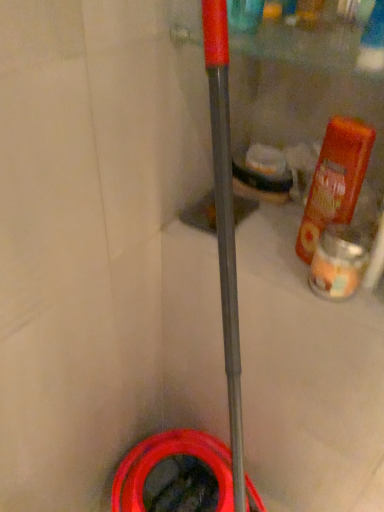
Question: From a real-world perspective, is orange matte bottle at right located higher than rubber/matte garden hose at lower center?

Choices:
 (A) no
 (B) yes

Answer: (B)

Question: Does orange matte bottle at right appear on the left side of rubber/matte garden hose at lower center?

Choices:
 (A) no
 (B) yes

Answer: (A)

Question: Is orange matte bottle at right facing away from rubber/matte garden hose at lower center?

Choices:
 (A) yes
 (B) no

Answer: (B)

Question: From a real-world perspective, is orange matte bottle at right below rubber/matte garden hose at lower center?

Choices:
 (A) no
 (B) yes

Answer: (A)

Question: Does orange matte bottle at right have a greater width compared to rubber/matte garden hose at lower center?

Choices:
 (A) no
 (B) yes

Answer: (A)

Question: Do you think translucent glass candle at right is within orange matte bottle at right, or outside of it?

Choices:
 (A) inside
 (B) outside

Answer: (B)

Question: Based on their sizes in the image, would you say translucent glass candle at right is bigger or smaller than orange matte bottle at right?

Choices:
 (A) small
 (B) big

Answer: (A)

Question: Considering their positions, is translucent glass candle at right located in front of or behind orange matte bottle at right?

Choices:
 (A) front
 (B) behind

Answer: (B)

Question: Is translucent glass candle at right to the left or to the right of orange matte bottle at right in the image?

Choices:
 (A) right
 (B) left

Answer: (B)

Question: In terms of height, does orange matte bottle at right look taller or shorter compared to translucent glass candle at right?

Choices:
 (A) tall
 (B) short

Answer: (A)

Question: Does point (329, 172) appear closer or farther from the camera than point (319, 283)?

Choices:
 (A) farther
 (B) closer

Answer: (B)

Question: In terms of width, does orange matte bottle at right look wider or thinner when compared to translucent glass candle at right?

Choices:
 (A) wide
 (B) thin

Answer: (B)

Question: Considering the relative positions of orange matte bottle at right and translucent glass candle at right in the image provided, is orange matte bottle at right to the left or to the right of translucent glass candle at right?

Choices:
 (A) left
 (B) right

Answer: (B)

Question: In terms of size, does translucent glass candle at right appear bigger or smaller than rubber/matte garden hose at lower center?

Choices:
 (A) big
 (B) small

Answer: (B)

Question: Considering the positions of translucent glass candle at right and rubber/matte garden hose at lower center in the image, is translucent glass candle at right wider or thinner than rubber/matte garden hose at lower center?

Choices:
 (A) wide
 (B) thin

Answer: (B)